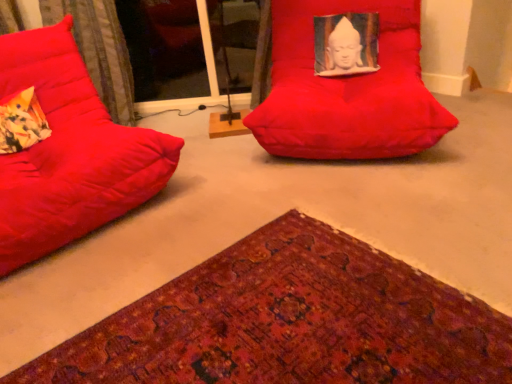
Question: Considering the positions of matte red bean bag at left, the 2th furniture when ordered from right to left, and matte red beanbag at center, positioned as the 2th furniture in left-to-right order, in the image, is matte red bean bag at left, the 2th furniture when ordered from right to left, taller or shorter than matte red beanbag at center, positioned as the 2th furniture in left-to-right order,?

Choices:
 (A) tall
 (B) short

Answer: (A)

Question: Is matte red bean bag at left, which ranks as the first furniture in left-to-right order, wider or thinner than matte red beanbag at center, positioned as the 2th furniture in left-to-right order?

Choices:
 (A) thin
 (B) wide

Answer: (A)

Question: Which is nearer to the velvet-like fabric at left?

Choices:
 (A) matte red beanbag at center, positioned as the 2th furniture in left-to-right order
 (B) transparent glass door at upper center
 (C) textured woolen mat at lower left
 (D) matte red bean bag at left, which ranks as the first furniture in left-to-right order
 (E) floral fabric pillow at left

Answer: (D)

Question: Considering the real-world distances, which object is closest to the matte red beanbag at center, positioned as the 2th furniture in left-to-right order?

Choices:
 (A) matte red bean bag at left, the 2th furniture when ordered from right to left
 (B) velvet-like fabric at left
 (C) transparent glass door at upper center
 (D) textured woolen mat at lower left
 (E) floral fabric pillow at left

Answer: (A)